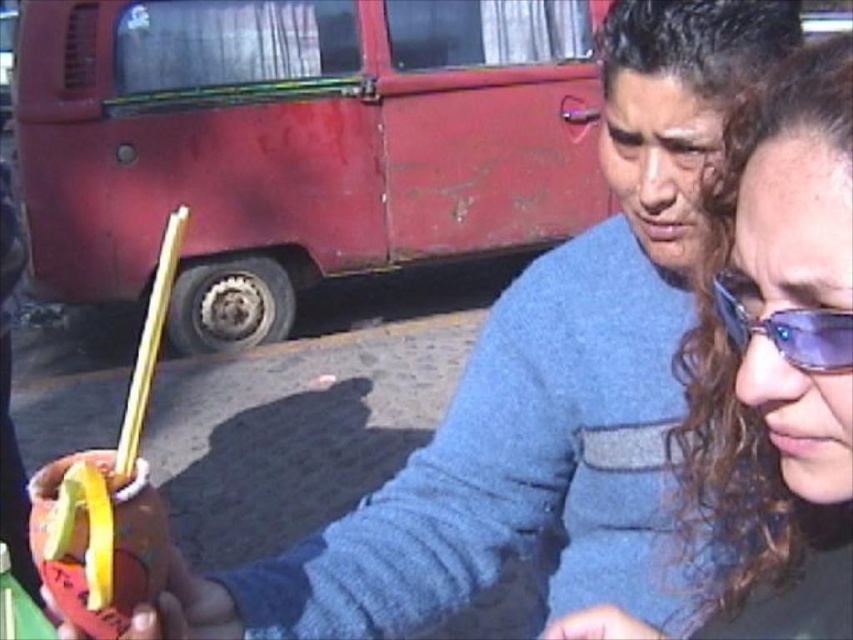
Who is more distant from viewer, (686,426) or (843,317)?

Positioned behind is point (686,426).

Locate an element on the screen. Image resolution: width=853 pixels, height=640 pixels. matte brown hair at center is located at coordinates (776, 358).

Find the location of a particular element. matte brown hair at center is located at coordinates (776, 358).